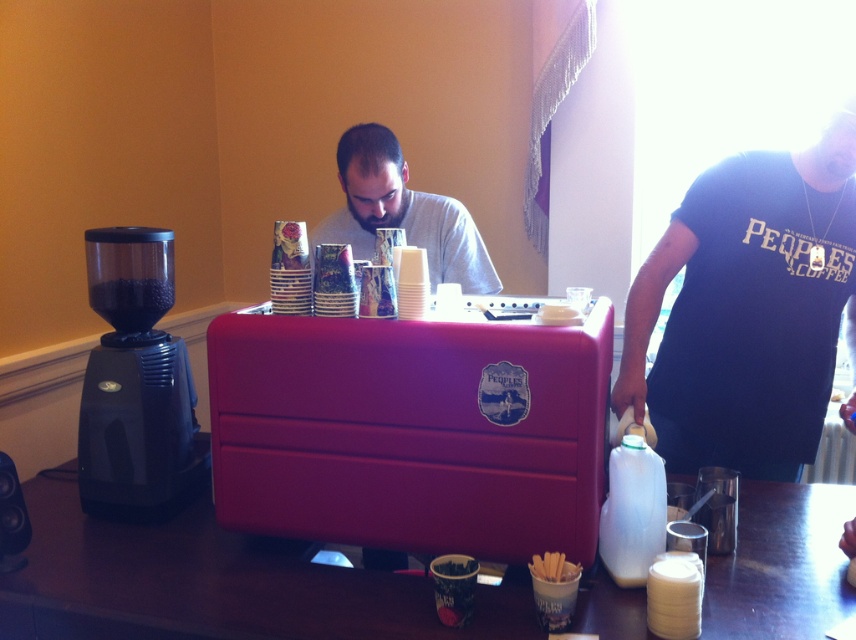
Is point (429, 589) less distant than point (756, 433)?

Yes, point (429, 589) is in front of point (756, 433).

From the picture: Which of these two, brown wooden table at center or dark blue t-shirt at right, stands shorter?

brown wooden table at center is shorter.

Is point (52, 547) farther from camera compared to point (658, 252)?

No, (52, 547) is closer to viewer.

This screenshot has height=640, width=856. I want to click on brown wooden table at center, so click(214, 584).

Does matte plastic cooler at center have a smaller size compared to dark blue t-shirt at right?

Yes.

Which is in front, point (385, 522) or point (724, 296)?

Positioned in front is point (385, 522).

Where is `matte plastic cooler at center`? The width and height of the screenshot is (856, 640). matte plastic cooler at center is located at coordinates (411, 432).

Locate an element on the screen. brown wooden table at center is located at coordinates (214, 584).

Is the position of brown wooden table at center more distant than that of gray matte shirt at center?

No, it is in front of gray matte shirt at center.

Is point (639, 634) farther from viewer compared to point (355, 189)?

No, it is not.

Find the location of a particular element. The height and width of the screenshot is (640, 856). brown wooden table at center is located at coordinates (214, 584).